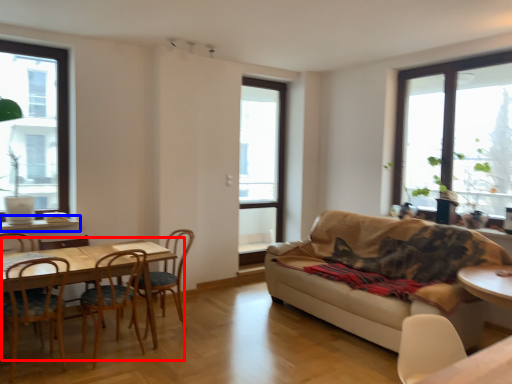
Question: Which point is further to the camera, kitchen & dining room table (highlighted by a red box) or window sill (highlighted by a blue box)?

Choices:
 (A) kitchen & dining room table
 (B) window sill

Answer: (B)